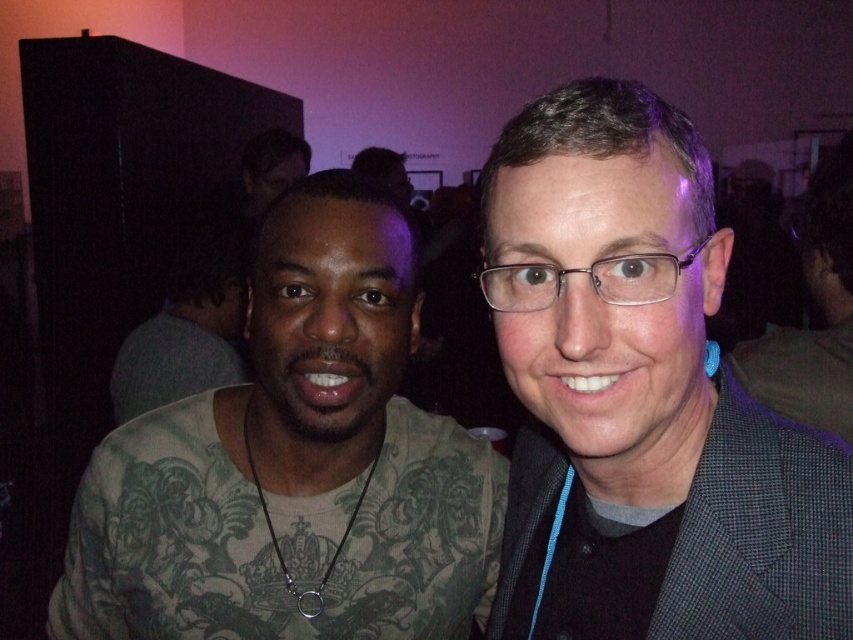
You are a photographer at the event and want to ensure both the green tattooed shirt at left and the gray checkered suit at center are clearly visible in your photo. Based on their positions, which clothing item is closer to the left edge of the frame?

The green tattooed shirt at left is positioned on the left side of the gray checkered suit at center, so it is closer to the left edge of the frame.

Based on the photo, you are a photographer at the event and want to ensure both the green tattooed shirt at left and the green tattooed shirt at center are clearly visible in your wide shot. Given their sizes, which shirt might appear closer to the camera?

The green tattooed shirt at left has a smaller size compared to the green tattooed shirt at center. Since smaller objects can appear farther away when they are actually closer, the photographer should position the green tattooed shirt at left closer to the camera to ensure both shirts appear clearly in the shot.

You are a photographer at the event and need to adjust the lighting to highlight the gray checkered blazer at right. Where should you focus the light?

The gray checkered blazer at right is located at point [641,397], so you should focus the light at that coordinate to highlight it.